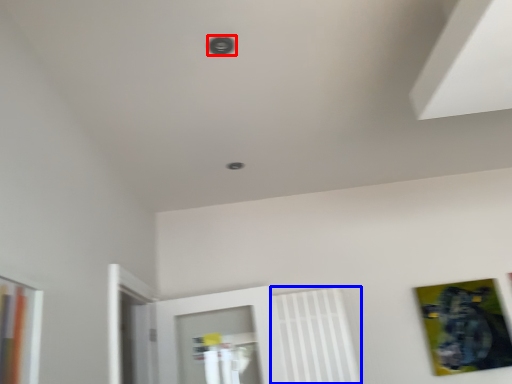
Question: Which object appears closest to the camera in this image, hole (highlighted by a red box) or radiator (highlighted by a blue box)?

Choices:
 (A) hole
 (B) radiator

Answer: (A)